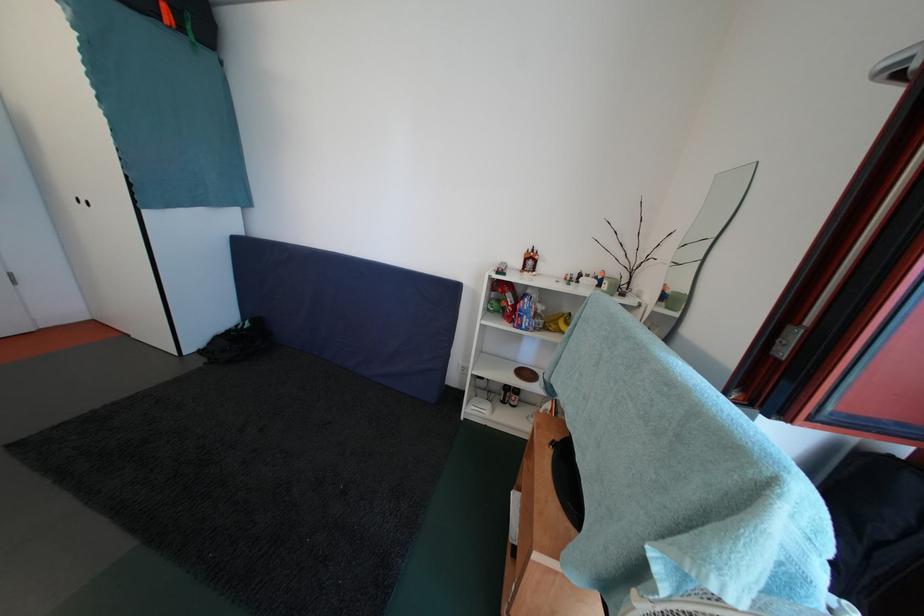
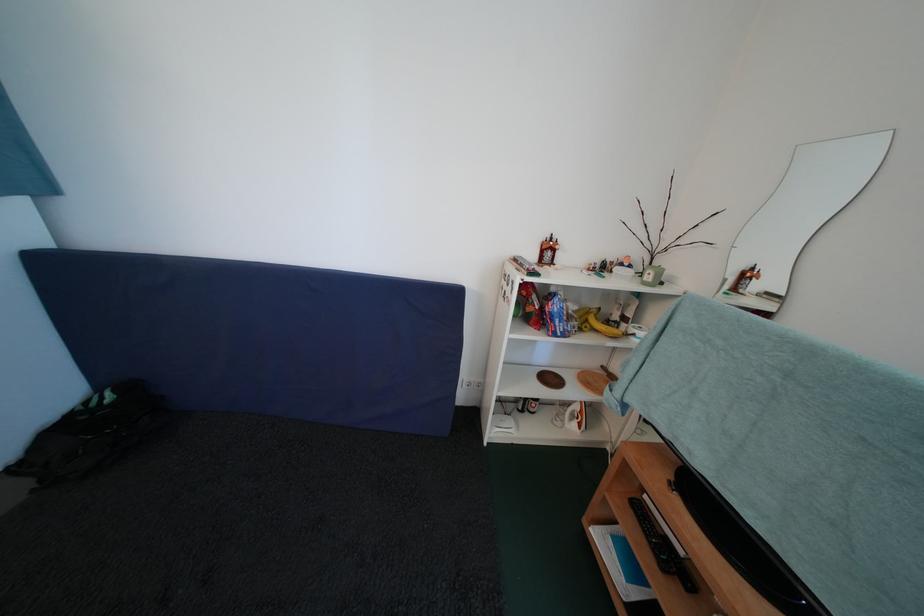
In the second image, find the point that corresponds to (x=548, y=313) in the first image.

(579, 313)